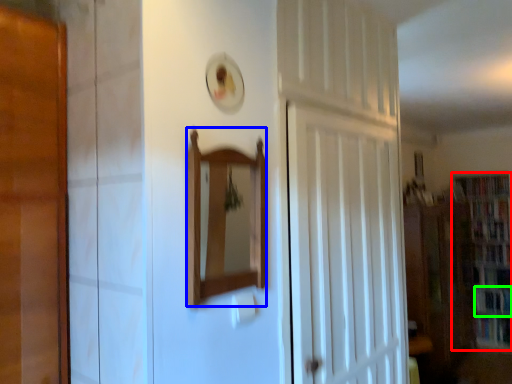
Question: Which is farther away from bookcase (highlighted by a red box)? mirror (highlighted by a blue box) or book (highlighted by a green box)?

Choices:
 (A) mirror
 (B) book

Answer: (A)